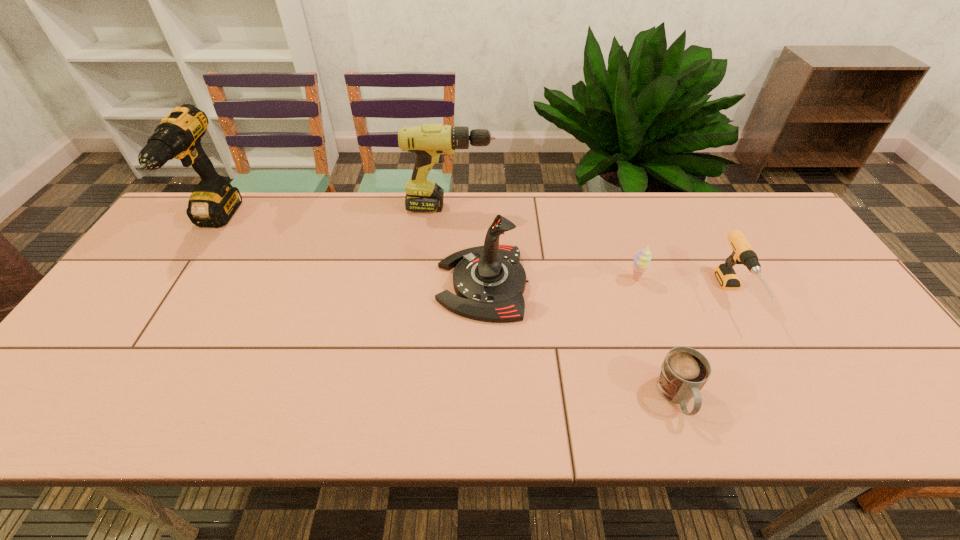
In the image, there is a desktop. Identify the location of vacant space at the left edge. (102, 348).

Locate an element on the screen. vacant space at the right edge of the desktop is located at coordinates (836, 327).

This screenshot has height=540, width=960. I want to click on vacant space at the far left corner of the desktop, so click(203, 228).

Find the location of `free location at the near left corner of the desktop`. free location at the near left corner of the desktop is located at coordinates [x=60, y=394].

This screenshot has width=960, height=540. I want to click on free space between the nearest object and the nearest drill, so click(x=706, y=346).

Image resolution: width=960 pixels, height=540 pixels. Identify the location of unoccupied position between the shortest object and the sherbert. (657, 338).

Locate an element on the screen. The height and width of the screenshot is (540, 960). empty space between the leftmost object and the second drill from left to right is located at coordinates click(332, 214).

At what (x,y) coordinates should I click in order to perform the action: click on empty location between the leftmost object and the second drill from left to right. Please return your answer as a coordinate pair (x, y). The height and width of the screenshot is (540, 960). Looking at the image, I should click on (332, 214).

This screenshot has width=960, height=540. I want to click on empty location between the rightmost object and the mug, so click(706, 346).

What are the coordinates of `free spot between the leftmost object and the second drill from right to left` in the screenshot? It's located at pyautogui.click(x=332, y=214).